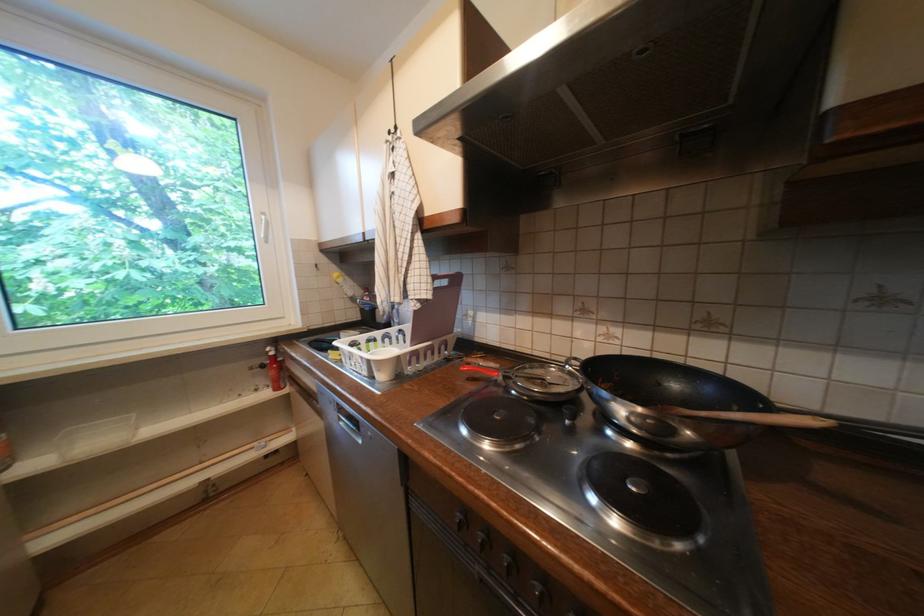
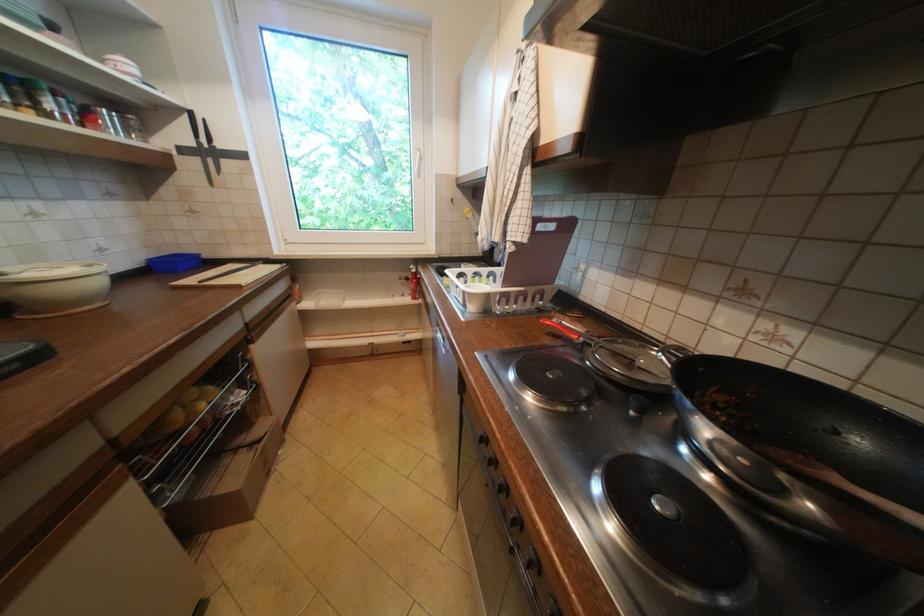
Find the pixel in the second image that matches pixel 628 411 in the first image.

(715, 430)